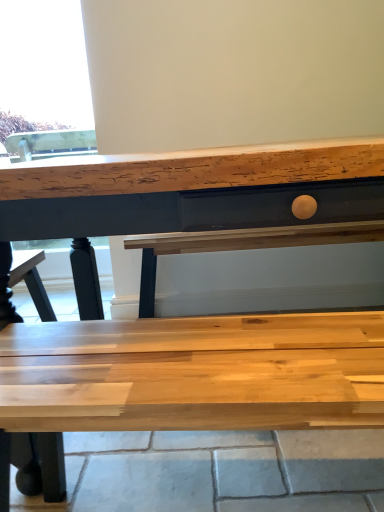
You are a GUI agent. You are given a task and a screenshot of the screen. Output one action in this format:
    pyautogui.click(x=<x>, y=<y>)
    Task: Click on the natural wood bench at center
    
    Given the screenshot: What is the action you would take?
    pyautogui.click(x=187, y=378)

Measure the distance between natural wood bench at center and camera.

The depth of natural wood bench at center is 21.71 inches.

The height and width of the screenshot is (512, 384). Describe the element at coordinates (187, 378) in the screenshot. I see `natural wood bench at center` at that location.

Locate an element on the screen. The image size is (384, 512). natural wood bench at center is located at coordinates (187, 378).